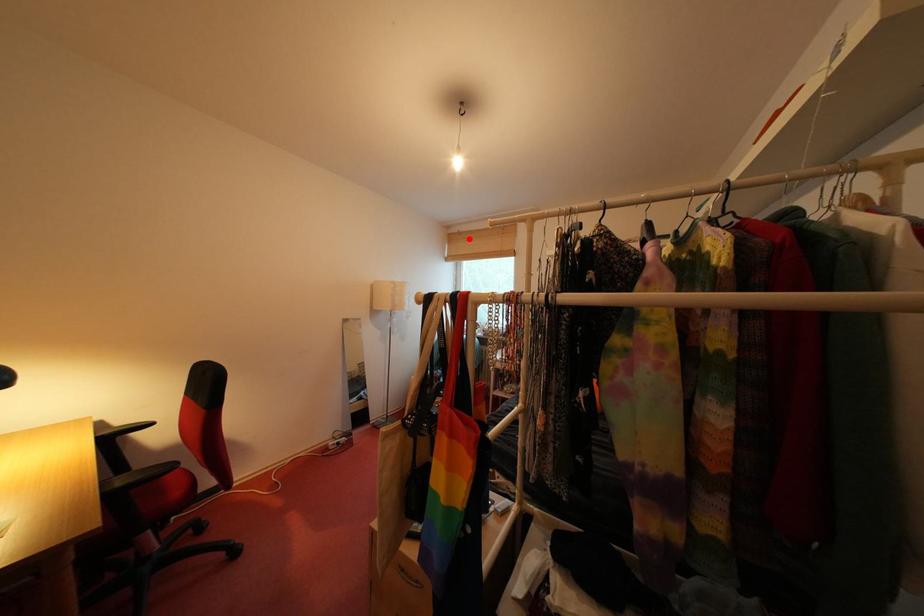
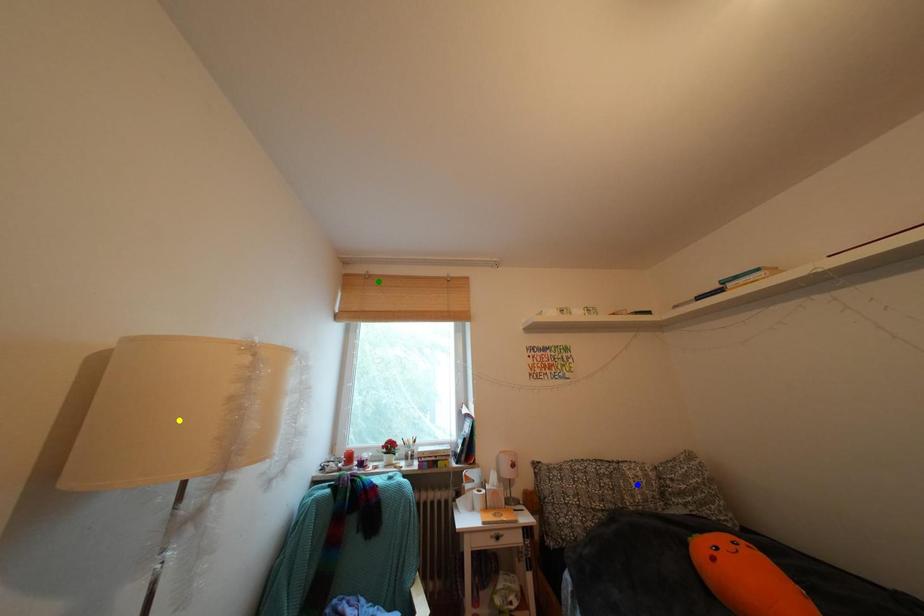
Question: I am providing you with two images of the same scene from different viewpoints. A red point is marked on the first image. You are given multiple points on the second image. Which point in image 2 is actually the same real-world point as the red point in image 1?

Choices:
 (A) yellow point
 (B) blue point
 (C) green point

Answer: (C)